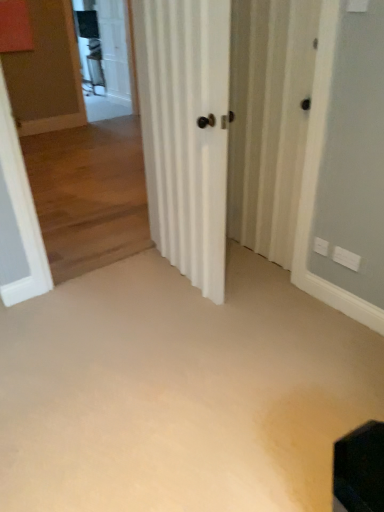
Question: From the image's perspective, is beige carpet at center above or below white matte door at center?

Choices:
 (A) above
 (B) below

Answer: (B)

Question: In the image, is beige carpet at center positioned in front of or behind white matte door at center?

Choices:
 (A) front
 (B) behind

Answer: (A)

Question: Which object is positioned farthest from the white matte door at center?

Choices:
 (A) beige carpet at center
 (B) white striped screen door at center, the first screen door viewed from the right
 (C) clear glass screen door at upper left, the 1th screen door from the back

Answer: (C)

Question: Which is nearer to the white matte door at center?

Choices:
 (A) clear glass screen door at upper left, the 2th screen door when ordered from front to back
 (B) white striped screen door at center, the first screen door viewed from the right
 (C) beige carpet at center

Answer: (B)